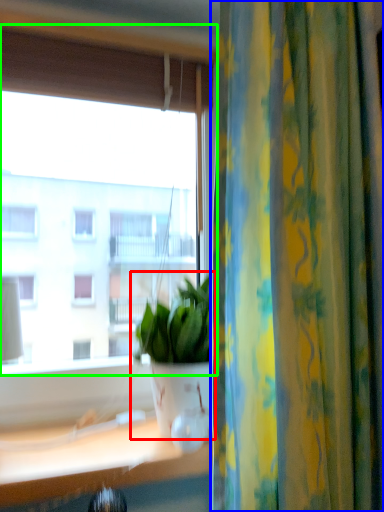
Question: Considering the real-world distances, which object is farthest from houseplant (highlighted by a red box)? curtain (highlighted by a blue box) or window (highlighted by a green box)?

Choices:
 (A) curtain
 (B) window

Answer: (B)